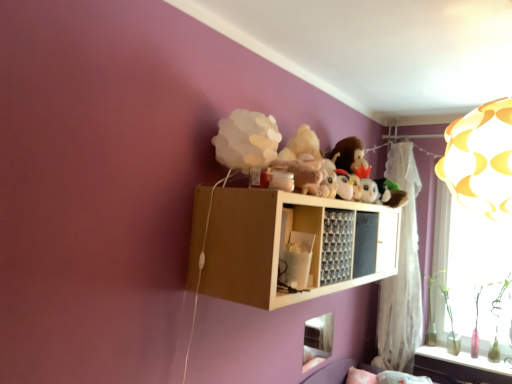
Question: Does wooden shelf at upper center come in front of white paper lampshade at upper center, the 2th toy viewed from the right?

Choices:
 (A) no
 (B) yes

Answer: (B)

Question: From the image's perspective, is wooden shelf at upper center located above white paper lampshade at upper center, acting as the 1th toy starting from the left?

Choices:
 (A) yes
 (B) no

Answer: (B)

Question: Considering the relative sizes of wooden shelf at upper center and white paper lampshade at upper center, the 2th toy viewed from the right, in the image provided, is wooden shelf at upper center smaller than white paper lampshade at upper center, the 2th toy viewed from the right,?

Choices:
 (A) yes
 (B) no

Answer: (B)

Question: From the image's perspective, is wooden shelf at upper center under white paper lampshade at upper center, the first toy viewed from the front?

Choices:
 (A) yes
 (B) no

Answer: (A)

Question: Is wooden shelf at upper center positioned far away from white paper lampshade at upper center, acting as the 1th toy starting from the left?

Choices:
 (A) yes
 (B) no

Answer: (B)

Question: From a real-world perspective, is wooden shelf at upper center positioned under white paper lampshade at upper center, the first toy viewed from the front, based on gravity?

Choices:
 (A) yes
 (B) no

Answer: (A)

Question: Does white sheer curtain at upper right have a larger size compared to white paper lampshade at upper center, acting as the 1th toy starting from the left?

Choices:
 (A) no
 (B) yes

Answer: (B)

Question: Is white sheer curtain at upper right wider than white paper lampshade at upper center, acting as the 2th toy starting from the back?

Choices:
 (A) yes
 (B) no

Answer: (B)

Question: Can you confirm if white sheer curtain at upper right is thinner than white paper lampshade at upper center, acting as the 2th toy starting from the back?

Choices:
 (A) no
 (B) yes

Answer: (B)

Question: Is the depth of white sheer curtain at upper right less than that of white paper lampshade at upper center, acting as the 1th toy starting from the left?

Choices:
 (A) yes
 (B) no

Answer: (B)

Question: Is white sheer curtain at upper right looking in the opposite direction of white paper lampshade at upper center, the 2th toy viewed from the right?

Choices:
 (A) no
 (B) yes

Answer: (A)

Question: Is white sheer curtain at upper right directly adjacent to white paper lampshade at upper center, the 2th toy viewed from the right?

Choices:
 (A) yes
 (B) no

Answer: (B)

Question: Considering the relative sizes of white plush penguin at center, placed as the second toy when sorted from front to back, and white paper lampshade at upper center, acting as the 2th toy starting from the back, in the image provided, is white plush penguin at center, placed as the second toy when sorted from front to back, shorter than white paper lampshade at upper center, acting as the 2th toy starting from the back,?

Choices:
 (A) no
 (B) yes

Answer: (B)